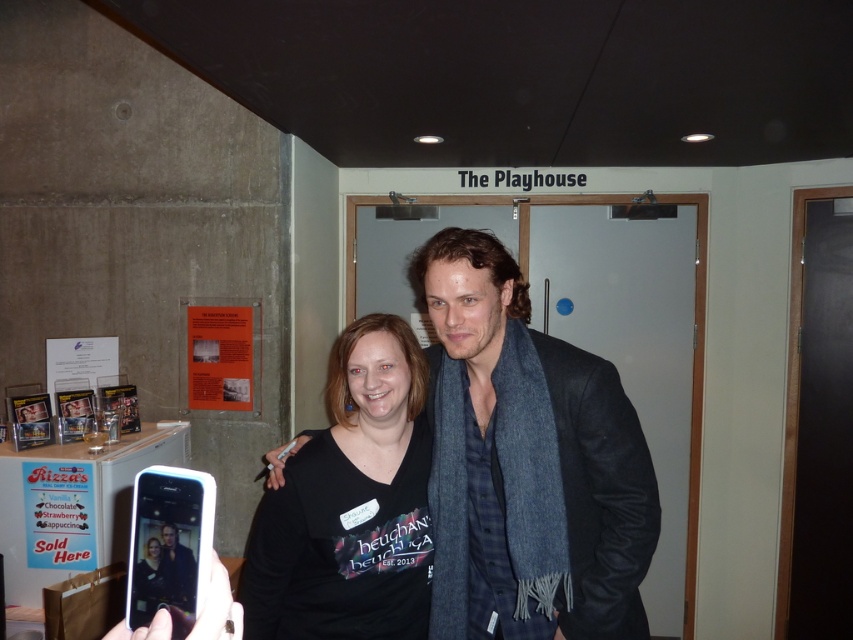
Question: Which object is farther from the camera taking this photo?

Choices:
 (A) dark gray wool scarf at center
 (B) black matte shirt at center

Answer: (B)

Question: Which point is farther to the camera?

Choices:
 (A) black matte shirt at center
 (B) dark gray wool scarf at center

Answer: (A)

Question: Is dark gray wool scarf at center to the left of black matte shirt at center from the viewer's perspective?

Choices:
 (A) yes
 (B) no

Answer: (B)

Question: Can you confirm if dark gray wool scarf at center is positioned above black matte shirt at center?

Choices:
 (A) yes
 (B) no

Answer: (A)

Question: Can you confirm if dark gray wool scarf at center is wider than black matte shirt at center?

Choices:
 (A) yes
 (B) no

Answer: (A)